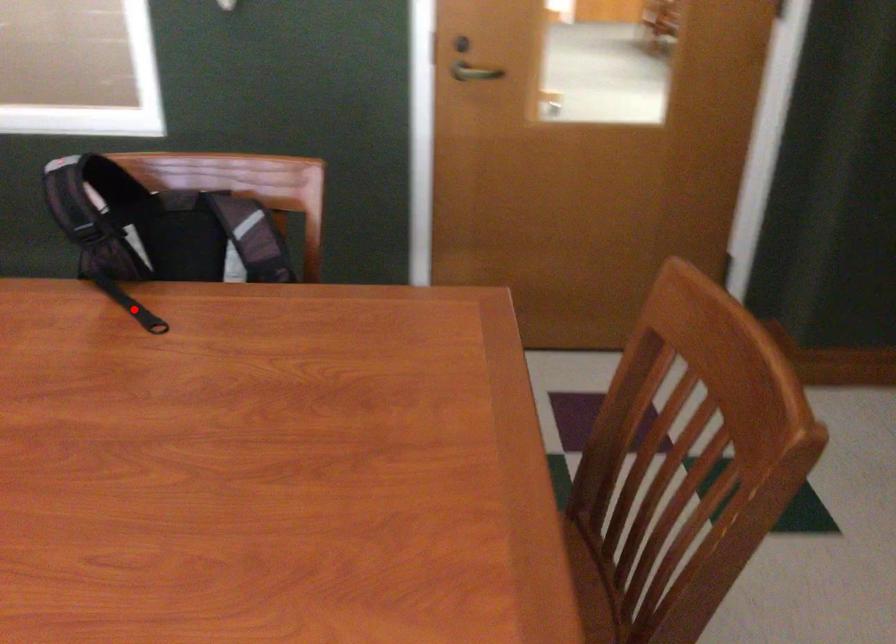
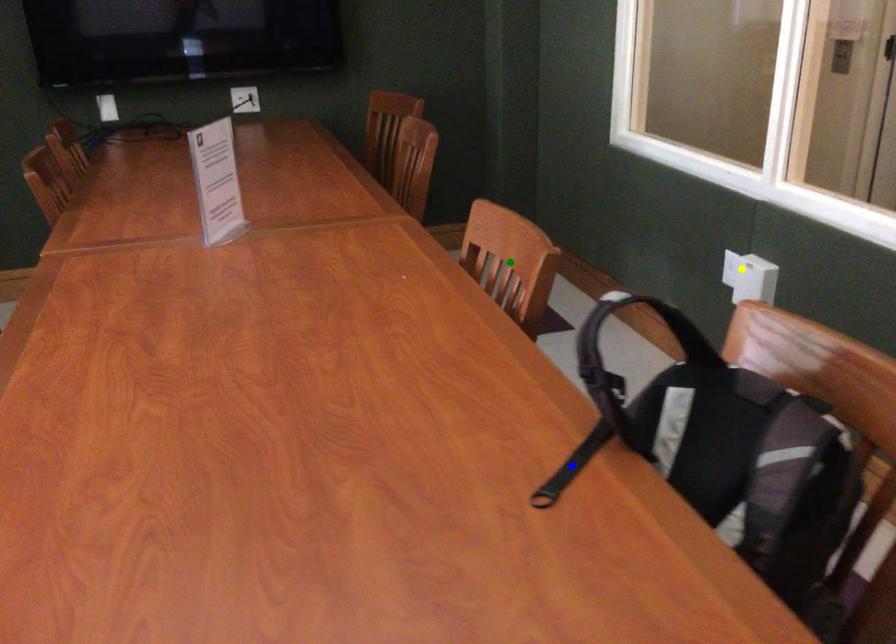
Question: I am providing you with two images of the same scene from different viewpoints. A red point is marked on the first image. You are given multiple points on the second image. In image 2, which mark is for the same physical point as the one in image 1?

Choices:
 (A) yellow point
 (B) green point
 (C) blue point

Answer: (C)